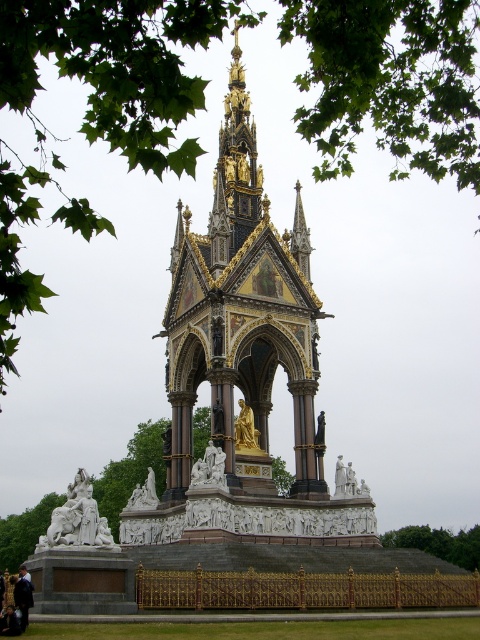
You are standing in front of the Albert Memorial and want to take a photo. You notice two points marked on the memorial, one at point coordinates (x=40, y=540) and another at (x=427, y=525). Which point is closer to you when you are facing the memorial?

Point (x=40, y=540) is closer to the viewer than point (x=427, y=525).

You are standing in front of the Albert Memorial in Kensington Gardens, London. You see a point at coordinates point (241, 317). Which object from the scene is this point located on?

The point (241, 317) is located on the gold gilded stone tower at center.